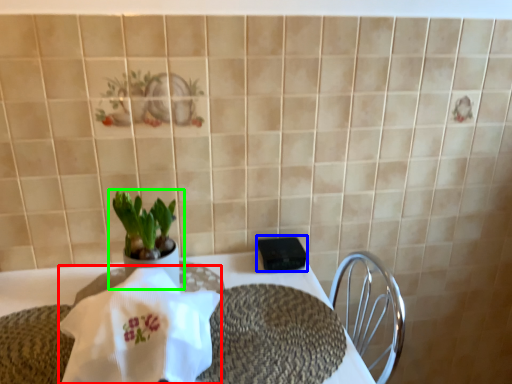
Question: Estimate the real-world distances between objects in this image. Which object is farther from cloth (highlighted by a red box), tableware (highlighted by a blue box) or houseplant (highlighted by a green box)?

Choices:
 (A) tableware
 (B) houseplant

Answer: (A)